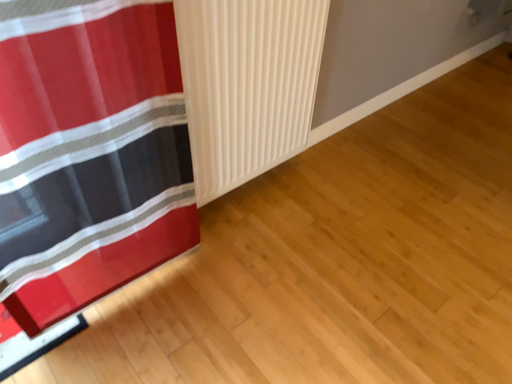
What do you see at coordinates (247, 84) in the screenshot? The width and height of the screenshot is (512, 384). I see `white ribbed curtain at center` at bounding box center [247, 84].

Measure the distance between point (193, 81) and camera.

A distance of 3.95 feet exists between point (193, 81) and camera.

What is the approximate height of white ribbed curtain at center?

white ribbed curtain at center is 30.45 inches in height.

In order to click on white ribbed curtain at center in this screenshot , I will do `click(247, 84)`.

The image size is (512, 384). I want to click on white ribbed curtain at center, so click(247, 84).